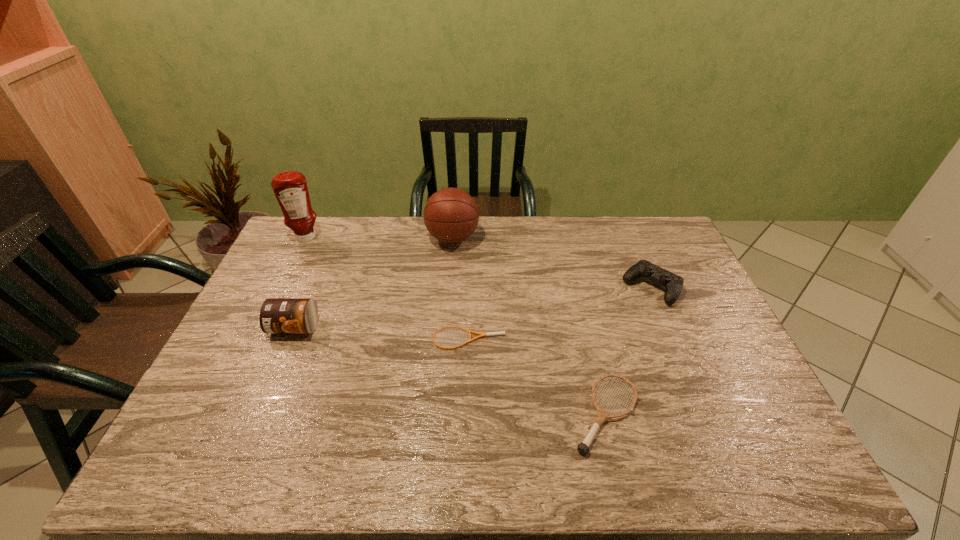
The height and width of the screenshot is (540, 960). Identify the location of condiment. (290, 188).

Identify the location of the fifth shortest object. (451, 215).

This screenshot has width=960, height=540. I want to click on can, so click(277, 315).

Identify the location of the rightmost object. (673, 283).

Where is `the fourth tallest object`? The image size is (960, 540). the fourth tallest object is located at coordinates (673, 283).

Where is `the fifth object from left to right`? The height and width of the screenshot is (540, 960). the fifth object from left to right is located at coordinates (583, 448).

Where is `the nearest object`? This screenshot has width=960, height=540. the nearest object is located at coordinates (583, 448).

Locate an element on the screen. The height and width of the screenshot is (540, 960). the farther tennis racket is located at coordinates pos(469,331).

You are a GUI agent. You are given a task and a screenshot of the screen. Output one action in this format:
    pyautogui.click(x=<x>, y=<y>)
    Task: Click on the shorter tennis racket
    
    Given the screenshot: What is the action you would take?
    pyautogui.click(x=469, y=331)

In order to click on free point located on the right of the tallest object in this screenshot , I will do `click(365, 238)`.